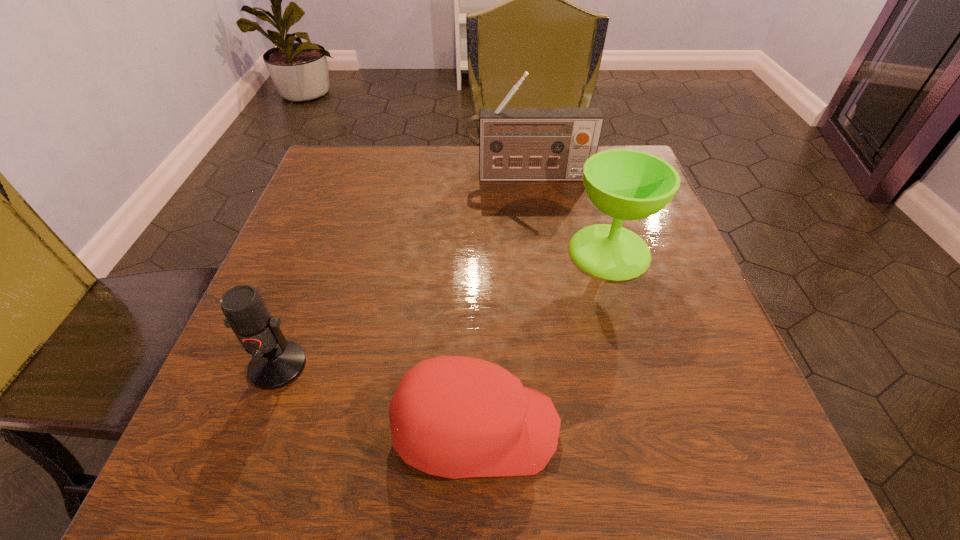
Image resolution: width=960 pixels, height=540 pixels. I want to click on the tallest object, so click(x=515, y=144).

Locate an element on the screen. radio receiver is located at coordinates (515, 144).

At what (x,y) coordinates should I click in order to perform the action: click on wineglass. Please return your answer as a coordinate pair (x, y). This screenshot has width=960, height=540. Looking at the image, I should click on (626, 184).

The width and height of the screenshot is (960, 540). Find the location of `the leftmost object`. the leftmost object is located at coordinates (276, 362).

At what (x,y) coordinates should I click in order to perform the action: click on cap. Please return your answer as a coordinate pair (x, y). Looking at the image, I should click on (457, 417).

Identify the location of vacant space situated on the front panel of the radio receiver. (532, 199).

The width and height of the screenshot is (960, 540). In order to click on blank space located 0.210m on the front of the wineglass in this screenshot , I will do `click(648, 381)`.

The image size is (960, 540). Identify the location of vacant space positioned on the side of the microphone with the red ring. (250, 443).

This screenshot has width=960, height=540. In order to click on vacant space located 0.060m on the front-facing side of the shortest object in this screenshot , I will do `click(602, 429)`.

Identify the location of object that is at the far edge. The height and width of the screenshot is (540, 960). (515, 144).